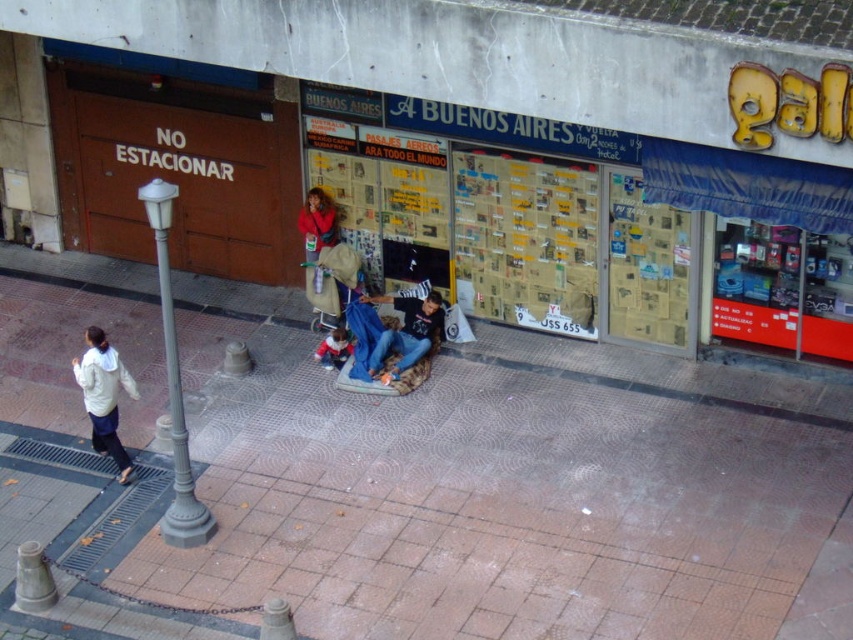
Question: Which point is closer to the camera?

Choices:
 (A) (102, 406)
 (B) (590, 500)

Answer: (B)

Question: Which point is closer to the camera?

Choices:
 (A) matte red jacket at center
 (B) white matte jacket at lower left
 (C) brown brick pavement at center
 (D) denim jeans at center

Answer: (C)

Question: From the image, what is the correct spatial relationship of brown brick pavement at center in relation to matte red jacket at center?

Choices:
 (A) below
 (B) above

Answer: (A)

Question: Does denim jeans at center appear under matte red jacket at center?

Choices:
 (A) yes
 (B) no

Answer: (A)

Question: Among these points, which one is farthest from the camera?

Choices:
 (A) (306, 195)
 (B) (426, 304)

Answer: (A)

Question: Can you confirm if brown brick pavement at center is smaller than denim jeans at center?

Choices:
 (A) no
 (B) yes

Answer: (A)